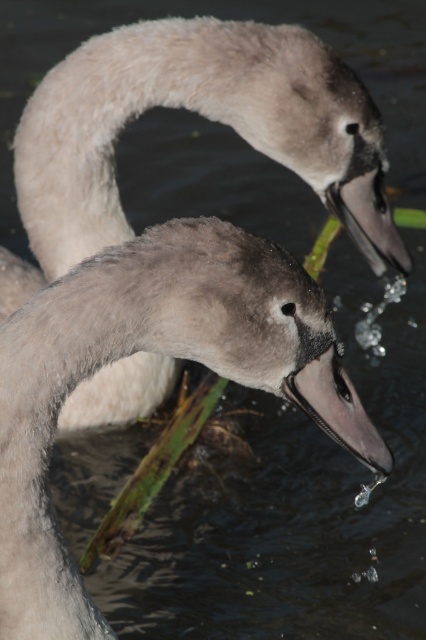
You are a wildlife photographer aiming to capture a photo of both the gray matte swan at center and the gray downy swan at center. Which swan should you focus on to ensure it appears larger in the photo?

The gray matte swan at center is much taller than the gray downy swan at center, so focusing on the gray matte swan at center will ensure it appears larger in the photo.

Consider the image. Please provide the exact coordinates of the gray matte swan at center in the image. The image has a coordinate system where the bottom left corner is the origin point. The coordinates are given as a pair of numbers between 0 and 1, with the first number representing the horizontal axis and the second the vertical axis.

The gray matte swan at center is located at coordinates point (163, 353).